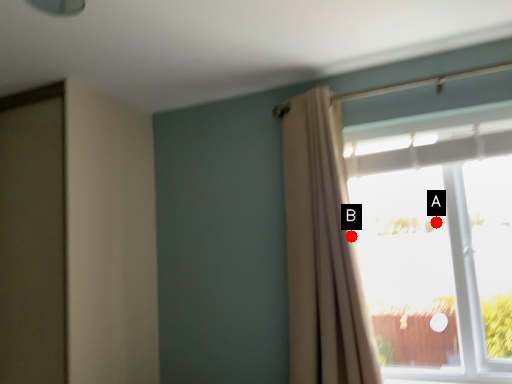
Question: Two points are circled on the image, labeled by A and B beside each circle. Which point is farther from the camera taking this photo?

Choices:
 (A) A is further
 (B) B is further

Answer: (A)